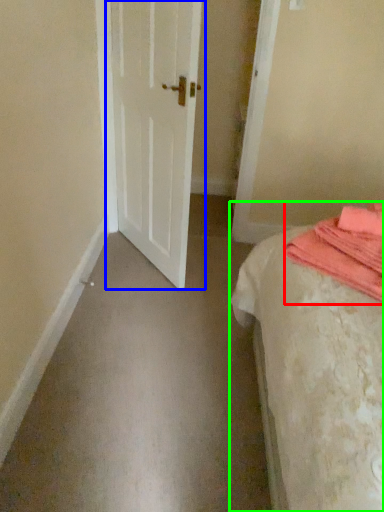
Question: Which object is positioned closest to blanket (highlighted by a red box)? Select from door (highlighted by a blue box) and bed (highlighted by a green box).

Choices:
 (A) door
 (B) bed

Answer: (B)